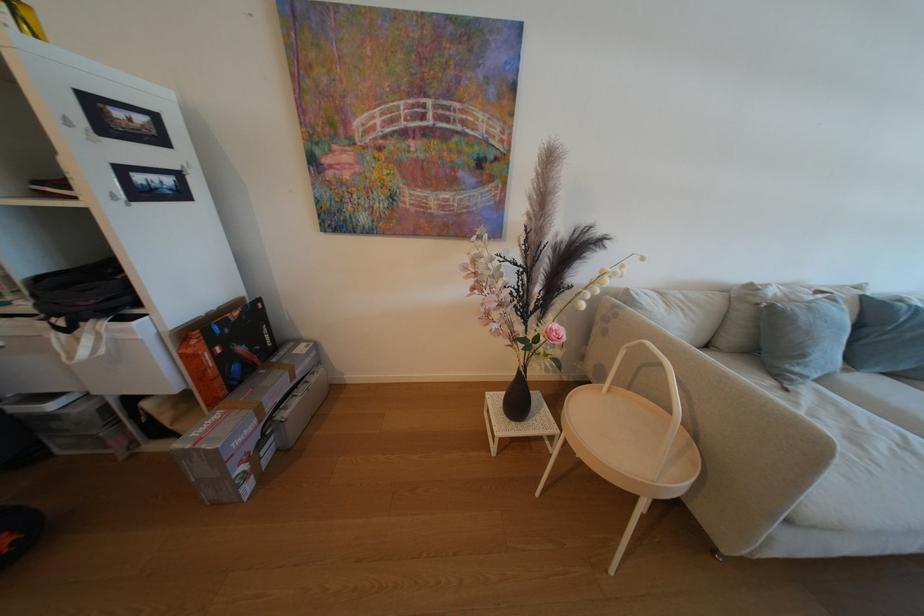
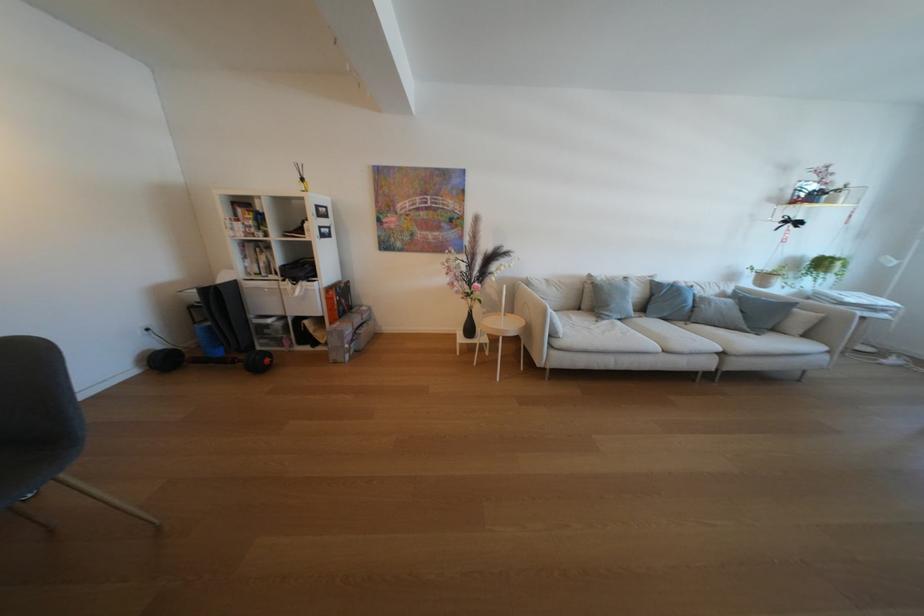
The point at [477,270] is marked in the first image. Where is the corresponding point in the second image?

(455, 265)